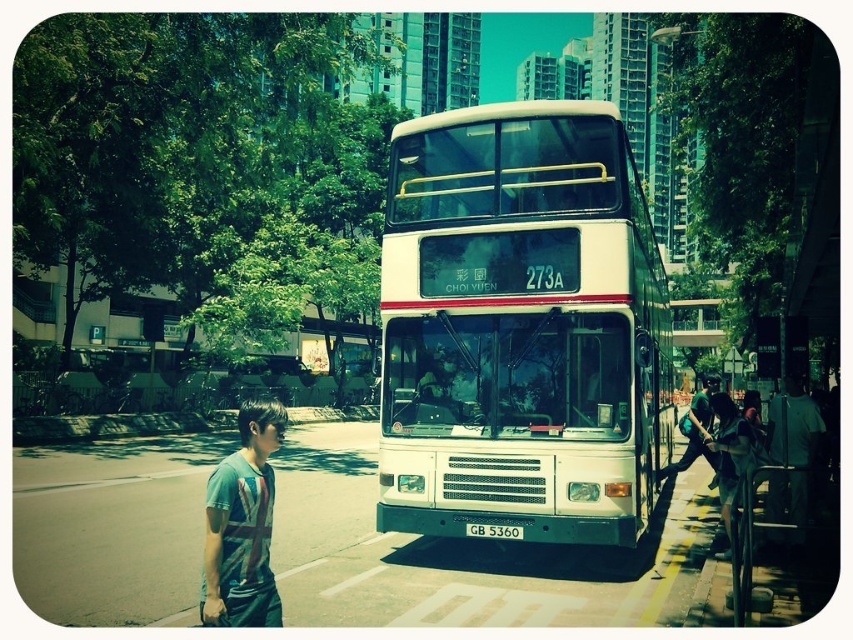
Question: Is printed cotton t-shirt at lower left positioned at the back of green fabric shirt at center?

Choices:
 (A) no
 (B) yes

Answer: (A)

Question: Observing the image, what is the correct spatial positioning of printed cotton t-shirt at lower left in reference to green fabric shirt at center?

Choices:
 (A) left
 (B) right

Answer: (A)

Question: Which of the following is the farthest from the observer?

Choices:
 (A) black plastic license plate at center
 (B) green fabric shirt at center

Answer: (B)

Question: Which point is farther to the camera?

Choices:
 (A) (537, 477)
 (B) (799, 410)

Answer: (B)

Question: Is white fabric shirt at right smaller than black plastic license plate at center?

Choices:
 (A) yes
 (B) no

Answer: (B)

Question: Among these points, which one is farthest from the camera?

Choices:
 (A) (686, 435)
 (B) (779, 486)
 (C) (212, 621)
 (D) (381, 288)

Answer: (A)